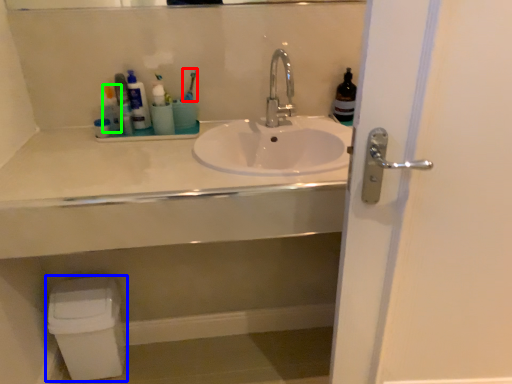
Question: Which object is the closest to the toothbrush (highlighted by a red box)? Choose among these: toilet bowl (highlighted by a blue box) or toiletry (highlighted by a green box).

Choices:
 (A) toilet bowl
 (B) toiletry

Answer: (B)